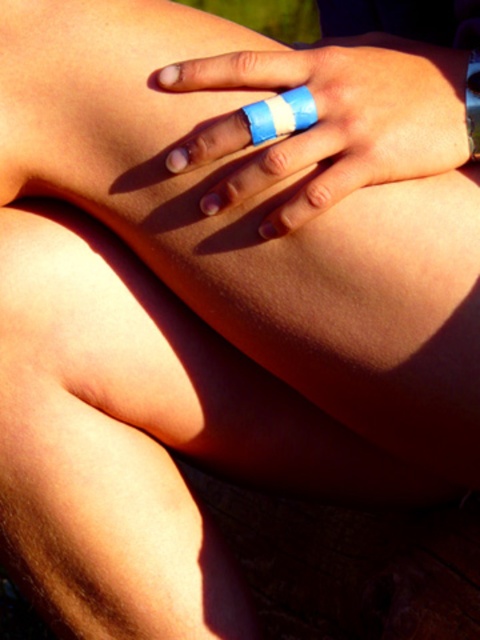
Question: Which object is closer to the camera taking this photo?

Choices:
 (A) blue tape at center
 (B) blue tape bandage at center

Answer: (B)

Question: Among these points, which one is farthest from the camera?

Choices:
 (A) (372, 45)
 (B) (264, 112)

Answer: (A)

Question: Does blue striped bandage at center have a larger size compared to blue tape at center?

Choices:
 (A) no
 (B) yes

Answer: (B)

Question: Does blue tape bandage at center appear on the left side of blue tape at center?

Choices:
 (A) no
 (B) yes

Answer: (B)

Question: Is blue striped bandage at center to the right of blue tape bandage at center from the viewer's perspective?

Choices:
 (A) no
 (B) yes

Answer: (B)

Question: Estimate the real-world distances between objects in this image. Which object is farther from the blue striped bandage at center?

Choices:
 (A) blue tape at center
 (B) blue tape bandage at center

Answer: (A)